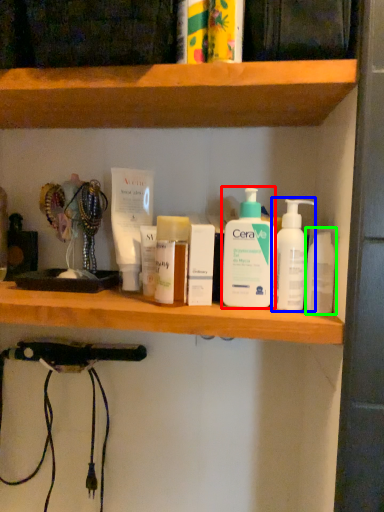
Question: Which object is the closest to the cleaning product (highlighted by a red box)? Choose among these: cleaning product (highlighted by a blue box) or mouthwash (highlighted by a green box).

Choices:
 (A) cleaning product
 (B) mouthwash

Answer: (A)